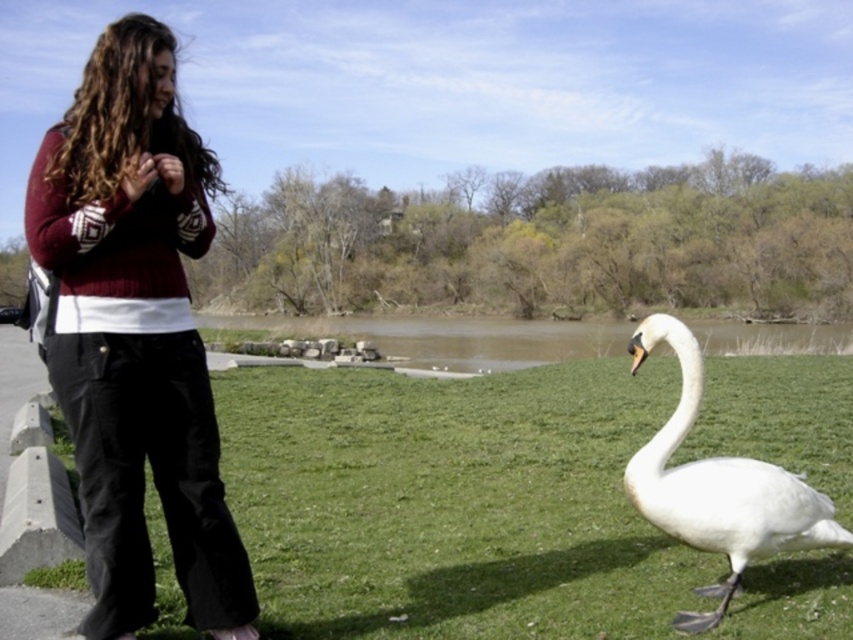
Can you confirm if maroon sweater at upper left is positioned below white glossy swan at lower right?

Actually, maroon sweater at upper left is above white glossy swan at lower right.

Can you confirm if maroon sweater at upper left is bigger than white glossy swan at lower right?

Actually, maroon sweater at upper left might be smaller than white glossy swan at lower right.

Between point (64, 122) and point (653, 460), which one is positioned behind?

Point (653, 460)

The height and width of the screenshot is (640, 853). I want to click on maroon sweater at upper left, so click(x=136, y=333).

This screenshot has height=640, width=853. Describe the element at coordinates (453, 502) in the screenshot. I see `green grass at lower center` at that location.

Who is positioned more to the left, green grass at lower center or white glossy swan at lower right?

Positioned to the left is green grass at lower center.

Where is `green grass at lower center`? This screenshot has height=640, width=853. green grass at lower center is located at coordinates (453, 502).

Consider the image. Is white glossy swan at lower right smaller than brown water at center?

Yes, white glossy swan at lower right is smaller than brown water at center.

Can you confirm if white glossy swan at lower right is thinner than brown water at center?

Yes, white glossy swan at lower right is thinner than brown water at center.

Between point (740, 476) and point (422, 346), which one is positioned behind?

Point (422, 346)

Find the location of `white glossy swan at lower right`. white glossy swan at lower right is located at coordinates (718, 486).